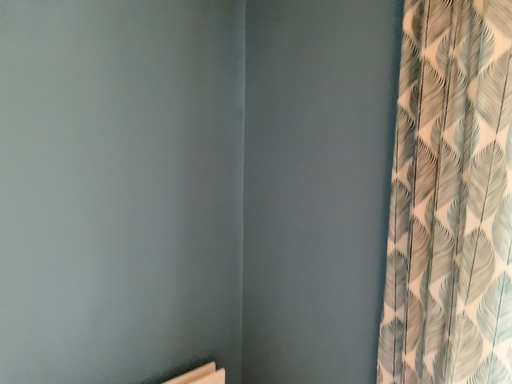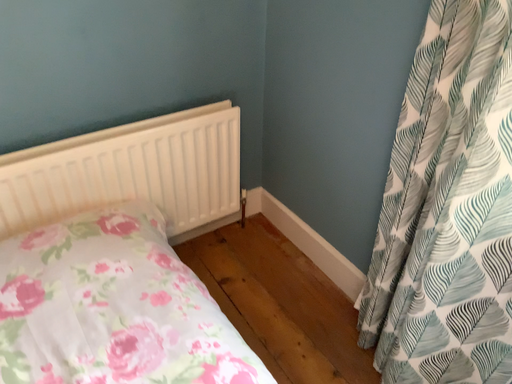
Question: Which way did the camera rotate in the video?

Choices:
 (A) rotated right
 (B) rotated left

Answer: (B)